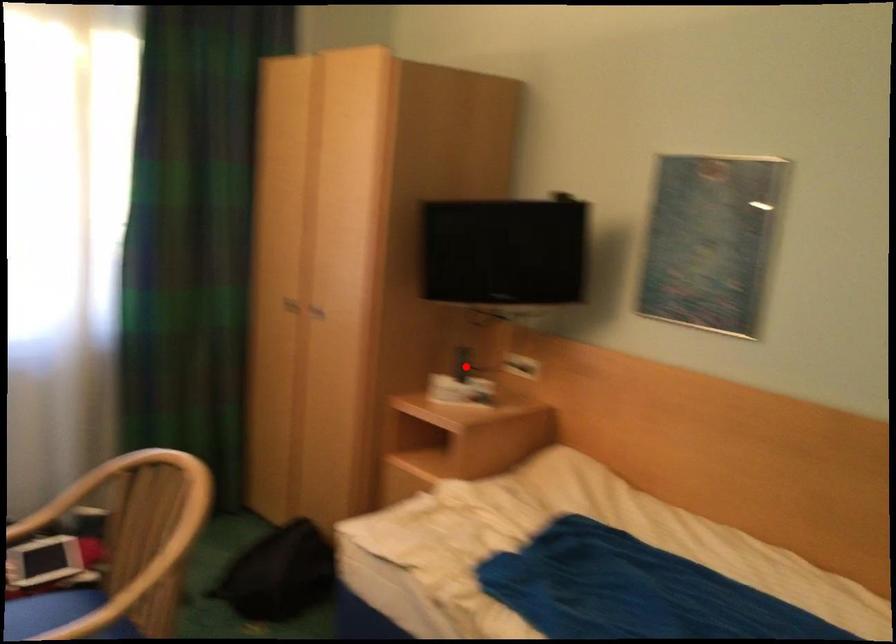
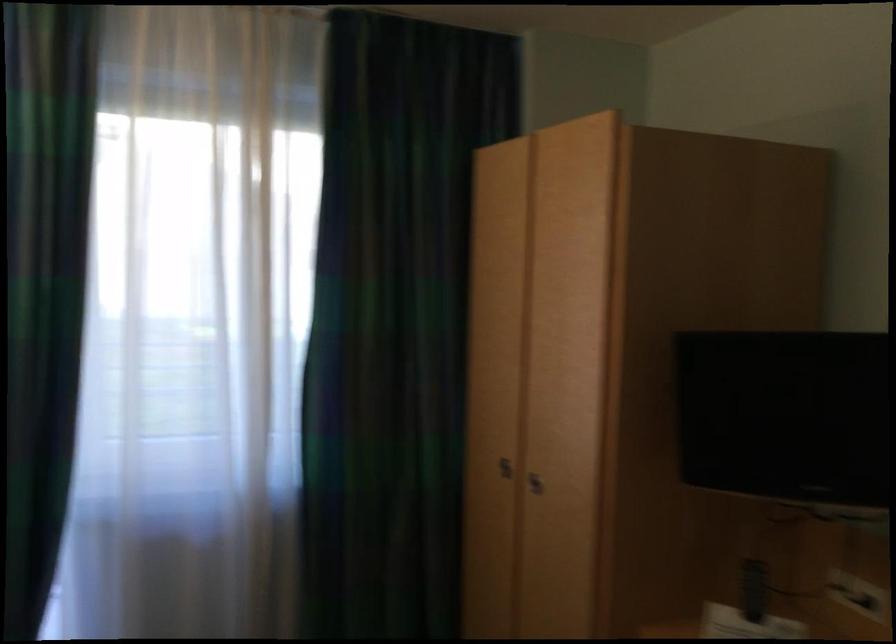
The point at the highlighted location is marked in the first image. Where is the corresponding point in the second image?

(754, 589)